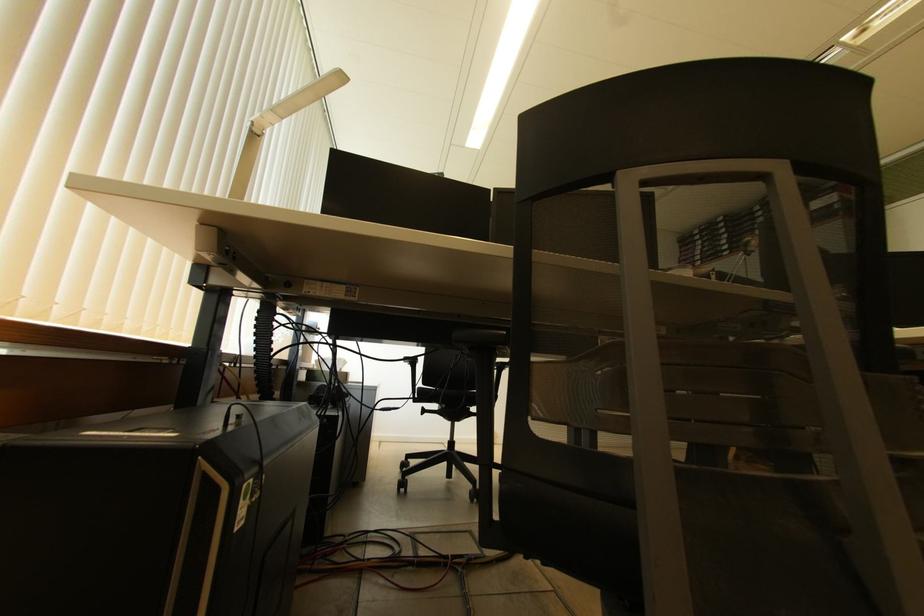
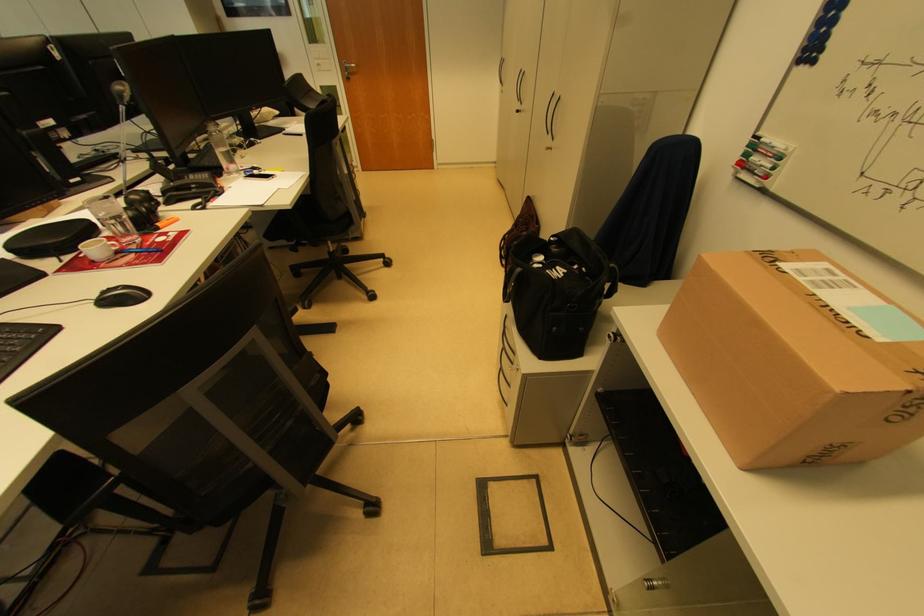
First-person continuous shooting, in which direction is the camera rotating?

The rotation direction of the camera is right-down.